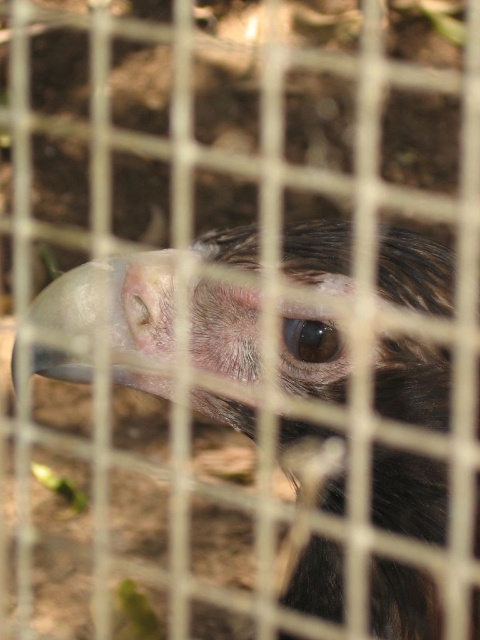
You are a zookeeper observing a bird enclosure. You notice the smooth feathered eagle at center and the brown glossy eye at center. Based on their positions, which object is closer to the front of the enclosure?

The brown glossy eye at center is closer to the front of the enclosure because the smooth feathered eagle at center is below it, indicating the eye is positioned in front.

You are a zookeeper observing a vulture through a metal grid. You notice two points on the grid at coordinates point (253, 353) and point (324, 358). Which point is closer to you?

Point (253, 353) is closer to you because it is further to the viewer than point (324, 358).

You are a wildlife photographer trying to capture a clear photo of the smooth feathered eagle at center and the brown glossy eye at center. Based on their sizes, which one would you need to focus on more closely to ensure sharpness?

The smooth feathered eagle at center is wider than the brown glossy eye at center, so you should focus more closely on the brown glossy eye at center to ensure sharpness.